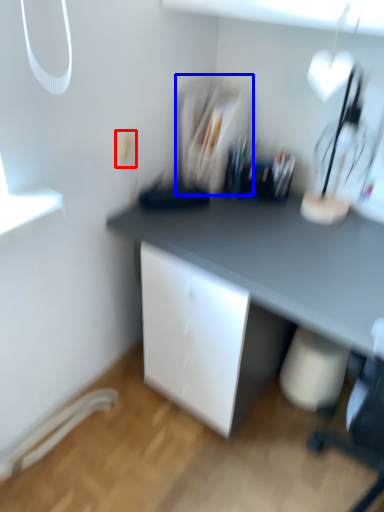
Question: Which point is closer to the camera, electric outlet (highlighted by a red box) or shelf (highlighted by a blue box)?

Choices:
 (A) electric outlet
 (B) shelf

Answer: (A)